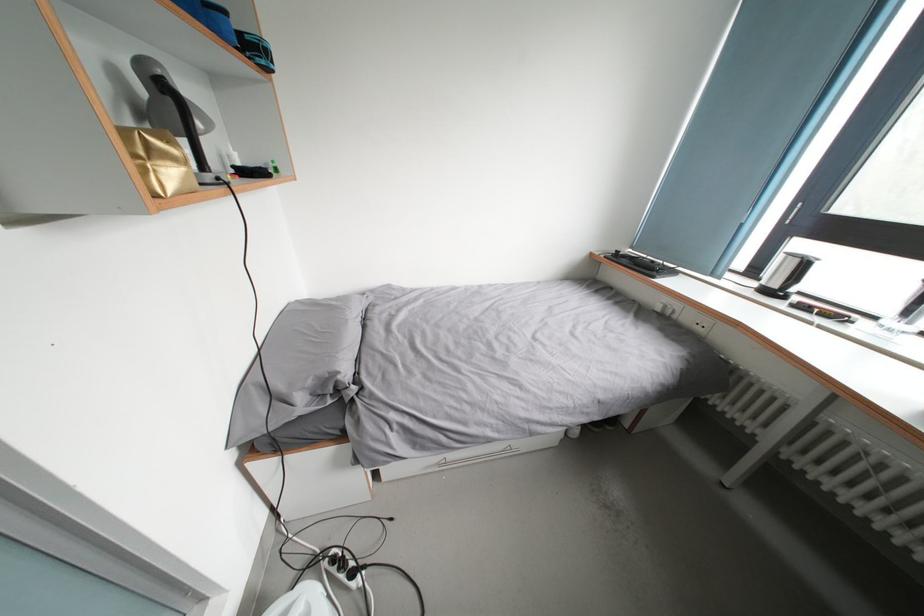
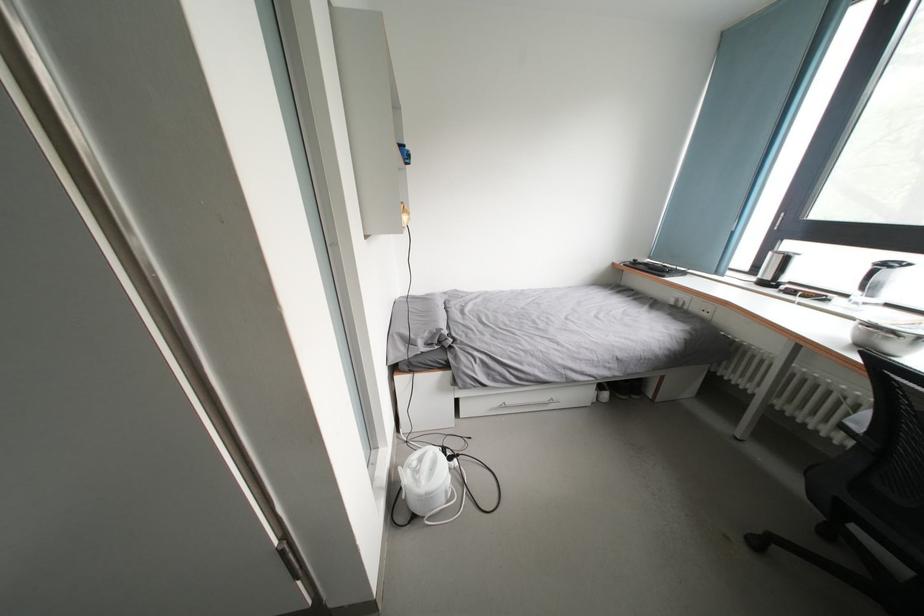
Find the pixel in the second image that matches [783,291] in the first image.

(774, 283)